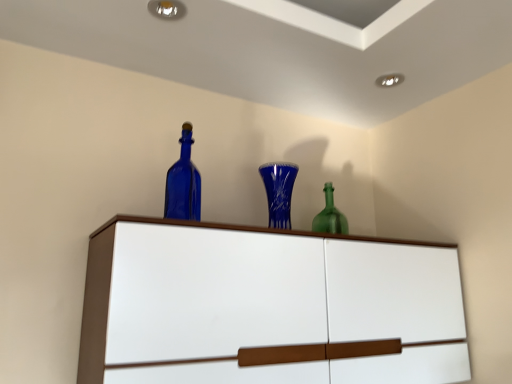
Question: From their relative heights in the image, would you say blue glass vase at center is taller or shorter than white glossy cupboard at upper center?

Choices:
 (A) short
 (B) tall

Answer: (A)

Question: Is point (275, 196) positioned closer to the camera than point (459, 319)?

Choices:
 (A) farther
 (B) closer

Answer: (B)

Question: Estimate the real-world distances between objects in this image. Which object is closer to the blue glass vase at center?

Choices:
 (A) blue glass bottle at upper center
 (B) white glossy cupboard at upper center

Answer: (A)

Question: Which object is the closest to the blue glass vase at center?

Choices:
 (A) white glossy cupboard at upper center
 (B) blue glass bottle at upper center

Answer: (B)